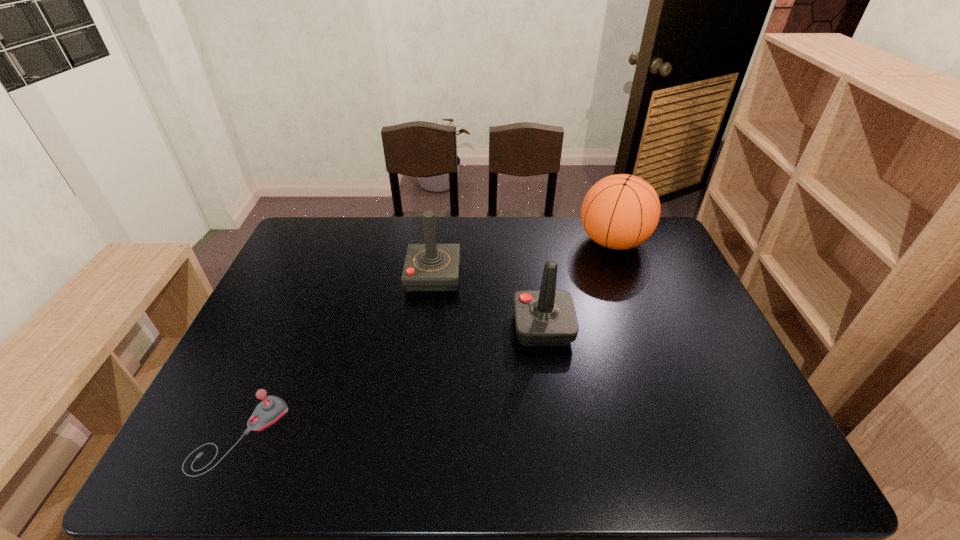
Where is `vacant point at the right edge`? The image size is (960, 540). vacant point at the right edge is located at coordinates (663, 298).

Locate an element on the screen. The image size is (960, 540). free space at the near right corner of the desktop is located at coordinates (755, 473).

This screenshot has width=960, height=540. I want to click on vacant region between the farthest joystick and the second nearest object, so click(488, 301).

Image resolution: width=960 pixels, height=540 pixels. Find the location of `vacant area that lies between the basketball and the nearest object`. vacant area that lies between the basketball and the nearest object is located at coordinates (426, 339).

You are a GUI agent. You are given a task and a screenshot of the screen. Output one action in this format:
    pyautogui.click(x=<x>, y=<y>)
    Task: Click on the vacant region between the shortest joystick and the farthest joystick
    Image resolution: width=960 pixels, height=540 pixels.
    Given the screenshot: What is the action you would take?
    pyautogui.click(x=337, y=355)

Find the location of a particular element. This screenshot has height=540, width=960. unoccupied position between the leftmost joystick and the second farthest joystick is located at coordinates (392, 381).

The image size is (960, 540). In order to click on free spot between the rightmost joystick and the second object from left to right in this screenshot , I will do pyautogui.click(x=488, y=301).

You are a GUI agent. You are given a task and a screenshot of the screen. Output one action in this format:
    pyautogui.click(x=<x>, y=<y>)
    Task: Click on the unoccupied position between the shortest joystick and the basketball
    
    Given the screenshot: What is the action you would take?
    (x=426, y=339)

Where is `unoccupied area between the third object from right to left and the rightmost joystick`? The width and height of the screenshot is (960, 540). unoccupied area between the third object from right to left and the rightmost joystick is located at coordinates (488, 301).

Locate an element on the screen. vacant space in between the rightmost joystick and the nearest object is located at coordinates (392, 381).